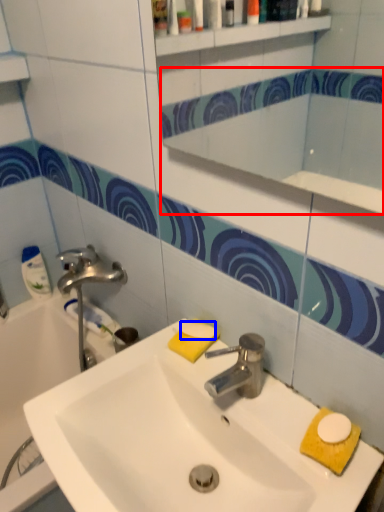
Question: Among these objects, which one is nearest to the camera, mirror (highlighted by a red box) or soap (highlighted by a blue box)?

Choices:
 (A) mirror
 (B) soap

Answer: (A)